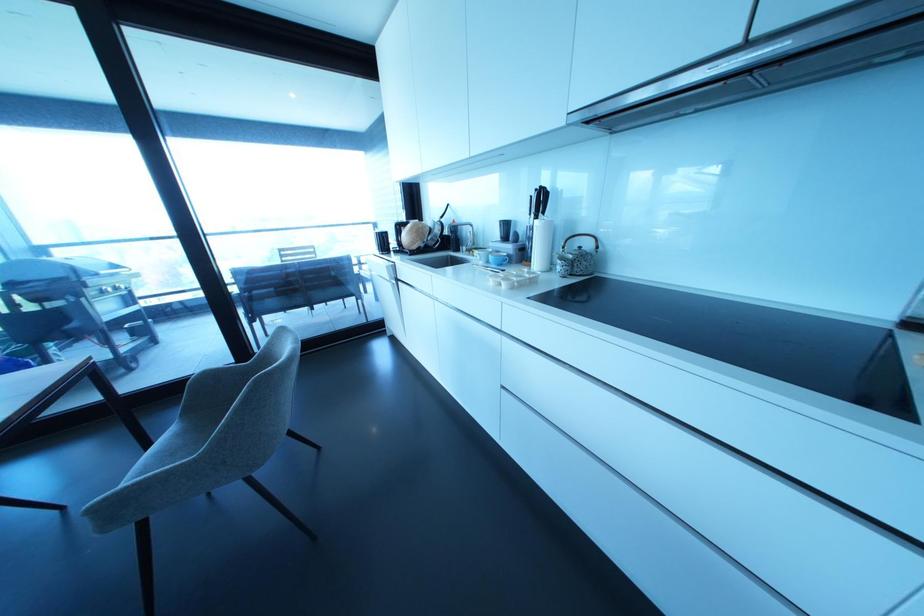
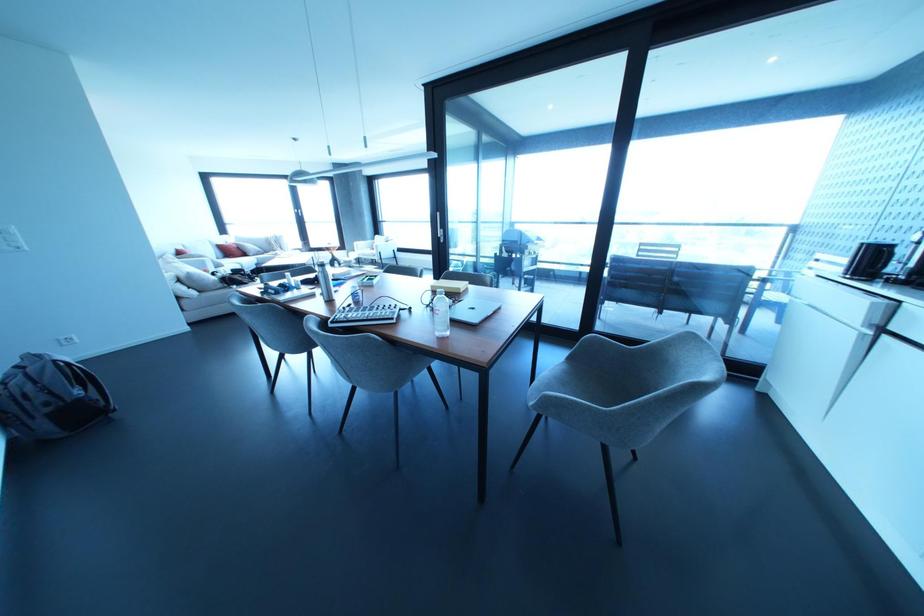
In the second image, find the point that corresponds to pixel 258 355 in the first image.

(646, 346)